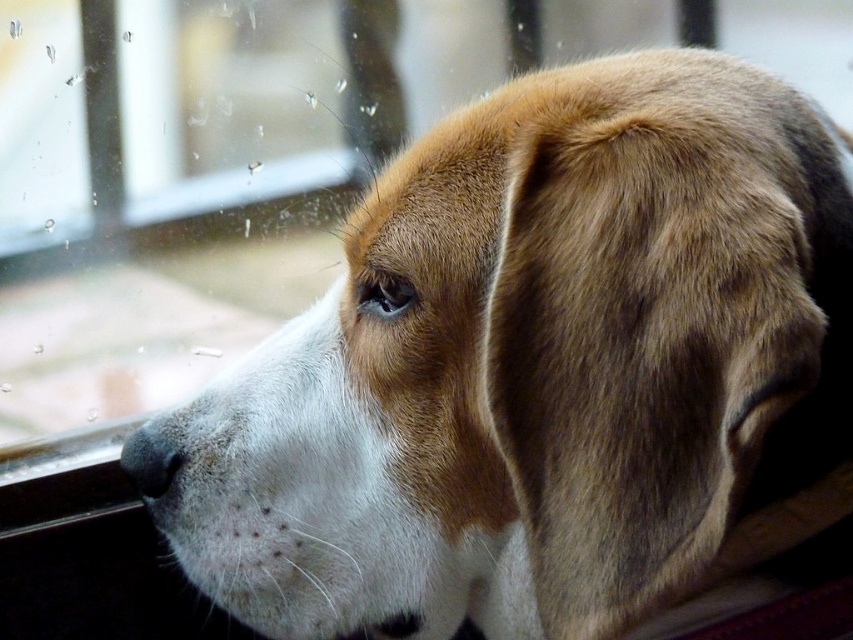
You are a dog owner trying to clean the window. You see the black plastic window sill at lower left and the black matte nose at lower left. Which object is closer to the left edge of the window?

The black plastic window sill at lower left is positioned on the left side of the black matte nose at lower left, so the black plastic window sill at lower left is closer to the left edge of the window.

You are a small toy measuring 15 centimeters in length. You want to roll from the black plastic window sill at lower left to the dog. Can you reach the dog?

The distance between the black plastic window sill at lower left and the viewer is 1.21 meters. Since the toy is only 15 centimeters long, it cannot cover the required distance of 121 centimeters on its own.